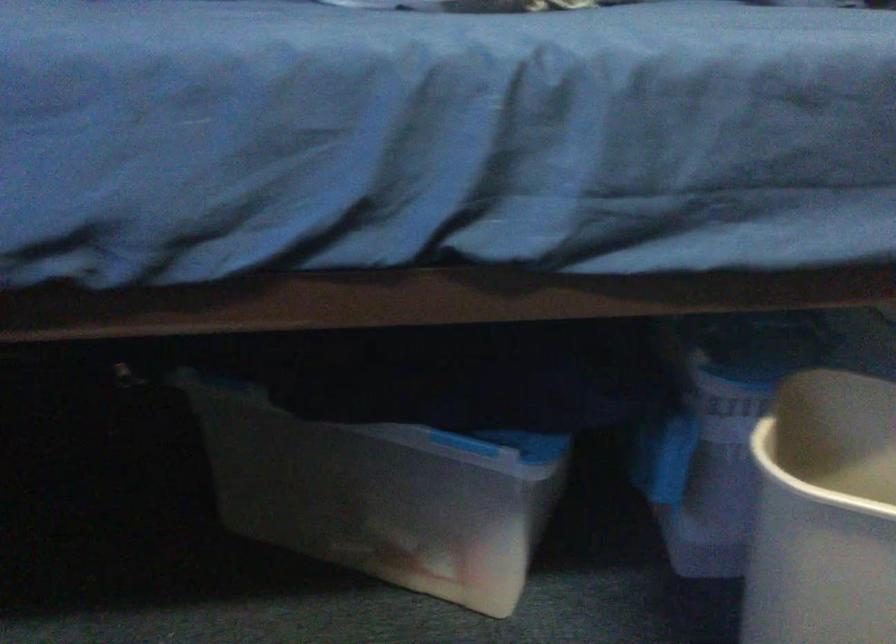
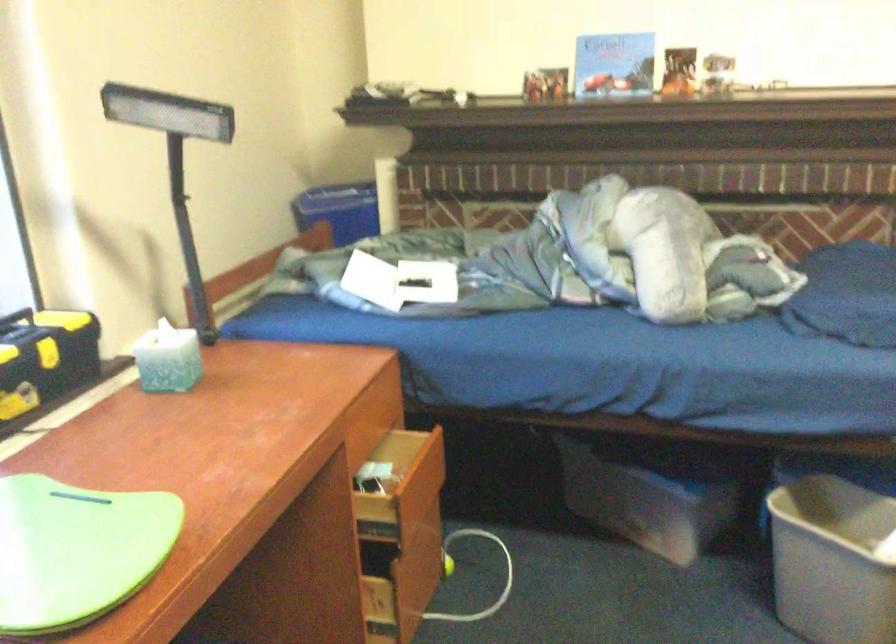
Question: Which direction would the cameraman need to move to produce the second image? Reply with the corresponding letter.

Choices:
 (A) Left
 (B) Right
 (C) Forward
 (D) Backward

Answer: (D)